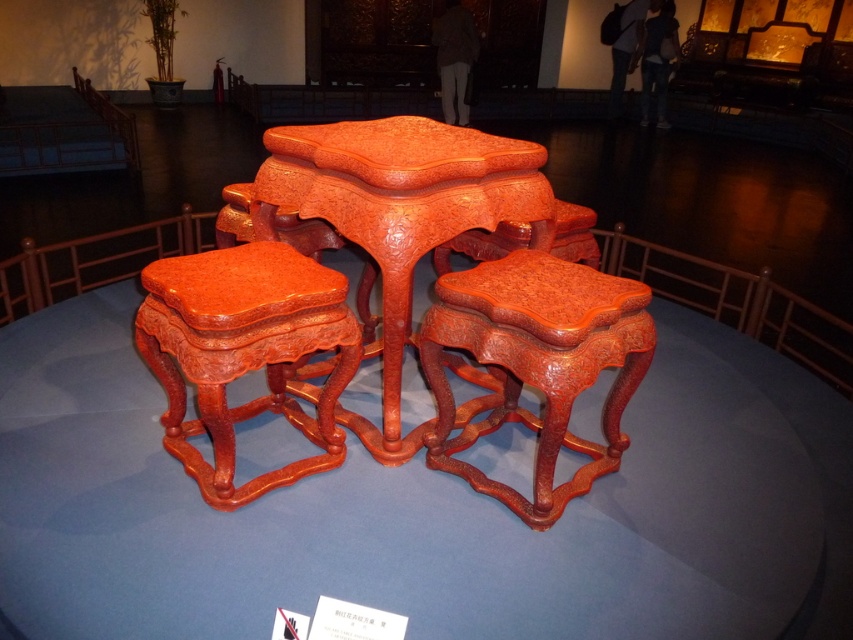
Consider the image. Between cinnabar lacquer table at center and glossy lacquered stool at center, which one has less height?

Standing shorter between the two is glossy lacquered stool at center.

Between cinnabar lacquer table at center and glossy lacquered stool at center, which one appears on the right side from the viewer's perspective?

cinnabar lacquer table at center is more to the right.

What do you see at coordinates (399, 216) in the screenshot?
I see `cinnabar lacquer table at center` at bounding box center [399, 216].

This screenshot has width=853, height=640. Identify the location of cinnabar lacquer table at center. (399, 216).

Which is more to the right, cinnabar lacquer stool at center or glossy lacquered stool at center?

From the viewer's perspective, cinnabar lacquer stool at center appears more on the right side.

Find the location of `cinnabar lacquer stool at center`. cinnabar lacquer stool at center is located at coordinates (535, 364).

Is cinnabar lacquer table at center further to camera compared to cinnabar lacquer stool at center?

Yes, it is behind cinnabar lacquer stool at center.

Consider the image. Does cinnabar lacquer table at center have a smaller size compared to cinnabar lacquer stool at center?

No.

Is point (402, 452) less distant than point (421, 346)?

No, (402, 452) is behind (421, 346).

This screenshot has width=853, height=640. Find the location of `cinnabar lacquer table at center`. cinnabar lacquer table at center is located at coordinates (399, 216).